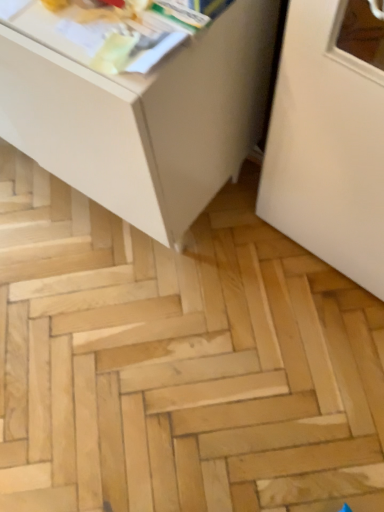
What is the approximate width of white matte desk at upper left?

white matte desk at upper left is 19.45 inches in width.

Where is `white matte desk at upper left`? white matte desk at upper left is located at coordinates (137, 104).

Describe the element at coordinates (137, 104) in the screenshot. I see `white matte desk at upper left` at that location.

Identify the location of white matte desk at upper left. (137, 104).